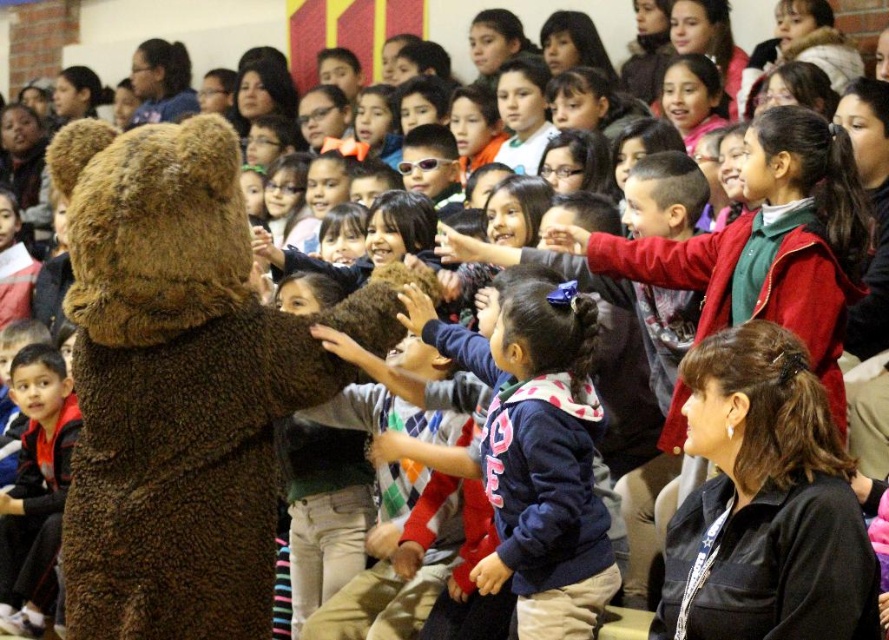
Question: Which point appears farthest from the camera in this image?

Choices:
 (A) (135, 154)
 (B) (34, 513)

Answer: (B)

Question: Does fuzzy brown bear at center appear over navy fleece jacket at center?

Choices:
 (A) no
 (B) yes

Answer: (B)

Question: Can you confirm if fuzzy brown bear at center is bigger than red fleece jacket at left?

Choices:
 (A) no
 (B) yes

Answer: (B)

Question: Which point is farther from the camera taking this photo?

Choices:
 (A) (589, 544)
 (B) (113, 292)
 (C) (50, 532)

Answer: (C)

Question: Can you confirm if fuzzy brown bear at center is bigger than red fleece jacket at left?

Choices:
 (A) no
 (B) yes

Answer: (B)

Question: Which of the following is the farthest from the observer?

Choices:
 (A) (581, 595)
 (B) (28, 541)
 (C) (206, 438)

Answer: (B)